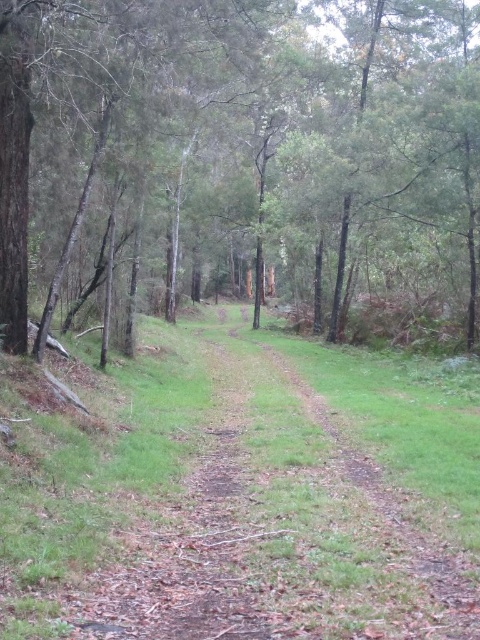
You are a hiker carrying a backpack and need to cross the narrow dirt path. The green matte tree at center and the brown dirt track at center are in your way. Can you walk between them without touching either?

The green matte tree at center and the brown dirt track at center are 9.90 meters apart, so yes, you can walk between them without touching either since the distance is sufficient for a person to pass through comfortably.

You are a hiker carrying a large backpack and need to walk along the narrow dirt path in the forest. There is a green matte tree at center and a brown dirt track at center. Which object will you have to navigate around due to its size?

The green matte tree at center is larger in size than the brown dirt track at center, so you will have to navigate around the green matte tree at center.